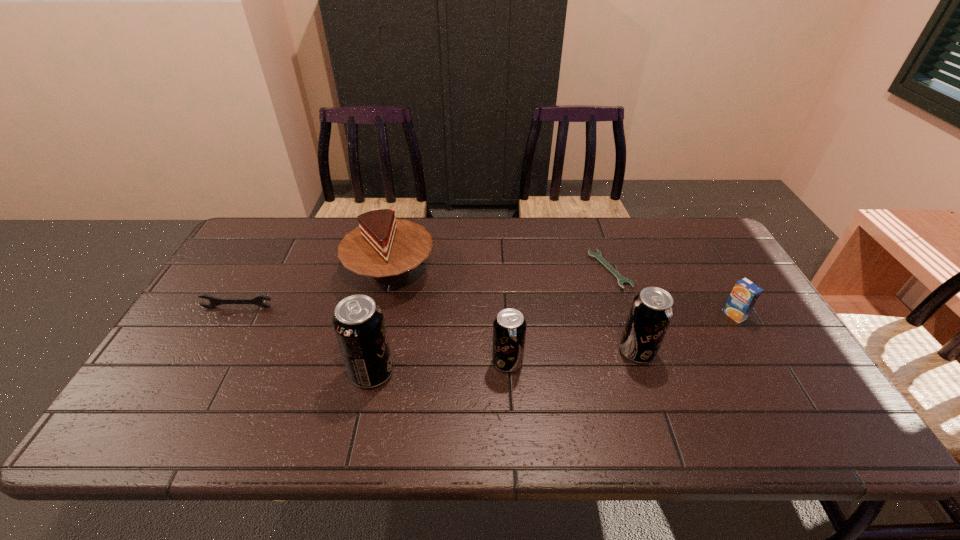
Where is `free space for a new soda can on the right`? The image size is (960, 540). free space for a new soda can on the right is located at coordinates (761, 342).